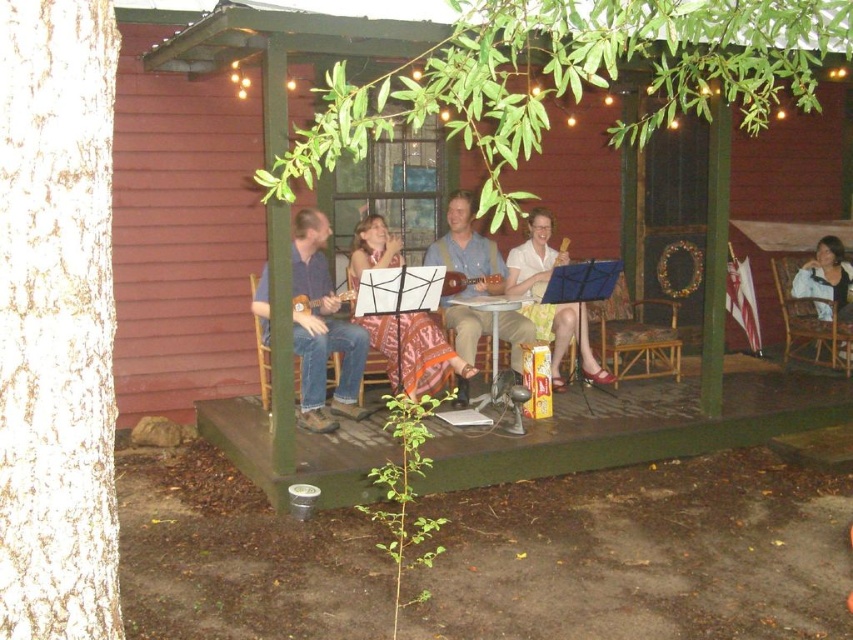
Looking at this image, between patterned fabric dress at center and wicker chair at right, which one is positioned higher?

Positioned higher is wicker chair at right.

Which is behind, point (398, 252) or point (788, 324)?

Positioned behind is point (788, 324).

What do you see at coordinates (415, 352) in the screenshot? The width and height of the screenshot is (853, 640). I see `patterned fabric dress at center` at bounding box center [415, 352].

The height and width of the screenshot is (640, 853). I want to click on patterned fabric dress at center, so click(x=415, y=352).

How much distance is there between woven wood chair at center and wooden chair at center?

They are 9.61 feet apart.

Locate an element on the screen. woven wood chair at center is located at coordinates (636, 337).

Is point (654, 346) more distant than point (258, 349)?

Yes, point (654, 346) is farther from viewer.

Where is `woven wood chair at center`? Image resolution: width=853 pixels, height=640 pixels. woven wood chair at center is located at coordinates (636, 337).

Is light brown wooden ukulele at center positioned in front of wooden chair at center?

No, light brown wooden ukulele at center is further to the viewer.

Between light brown wooden ukulele at center and wooden chair at center, which one has less height?

Standing shorter between the two is wooden chair at center.

The image size is (853, 640). In order to click on light brown wooden ukulele at center in this screenshot , I will do `click(467, 250)`.

You are a GUI agent. You are given a task and a screenshot of the screen. Output one action in this format:
    pyautogui.click(x=<x>, y=<y>)
    Task: Click on the light brown wooden ukulele at center
    The image size is (853, 640).
    Given the screenshot: What is the action you would take?
    pyautogui.click(x=467, y=250)